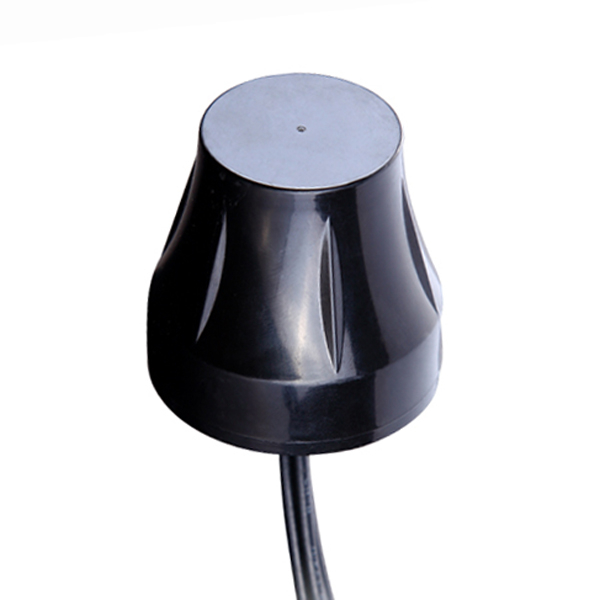
What are the coordinates of `power cord` in the screenshot? It's located at (304, 515).